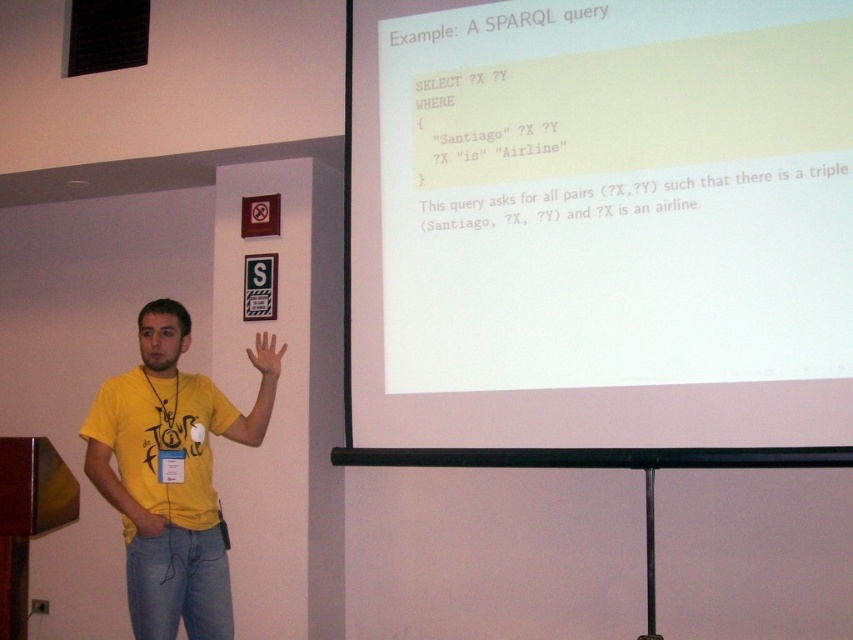
Is yellow t-shirt at center above matte yellow hand at center?

Actually, yellow t-shirt at center is below matte yellow hand at center.

In the scene shown: Between yellow t-shirt at center and matte yellow hand at center, which one has more height?

yellow t-shirt at center

Is point (254, 435) farther from viewer compared to point (281, 349)?

No, (254, 435) is closer to viewer.

Where is `yellow t-shirt at center`? The height and width of the screenshot is (640, 853). yellow t-shirt at center is located at coordinates (169, 477).

Image resolution: width=853 pixels, height=640 pixels. Describe the element at coordinates (601, 221) in the screenshot. I see `white paper at upper center` at that location.

Measure the distance from white paper at upper center to matte yellow hand at center.

white paper at upper center and matte yellow hand at center are 3.69 feet apart from each other.

Between point (775, 310) and point (271, 355), which one is positioned in front?

Positioned in front is point (775, 310).

You are a GUI agent. You are given a task and a screenshot of the screen. Output one action in this format:
    pyautogui.click(x=<x>, y=<y>)
    Task: Click on the white paper at upper center
    The width and height of the screenshot is (853, 640).
    Given the screenshot: What is the action you would take?
    pyautogui.click(x=601, y=221)

Is yellow t-shirt at center to the right of yellow matte hand at lower left from the viewer's perspective?

Indeed, yellow t-shirt at center is positioned on the right side of yellow matte hand at lower left.

Does yellow t-shirt at center appear over yellow matte hand at lower left?

Correct, yellow t-shirt at center is located above yellow matte hand at lower left.

Find the location of a particular element. yellow t-shirt at center is located at coordinates (169, 477).